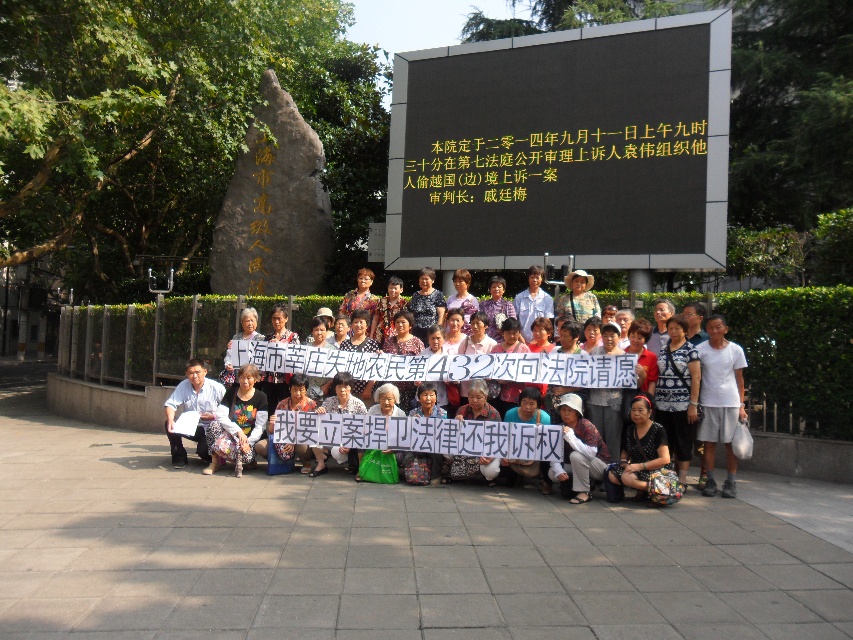
You are a photographer standing in front of the large stone monument. You notice the black matte sign at upper center and the white cotton shirt at center. Which object is taller?

The black matte sign at upper center is taller than the white cotton shirt at center.

You are a photographer standing in front of the monument and the digital display board. You want to take a photo that clearly shows both the black matte sign at upper center and the yellow text at upper center. However, you notice that one of them is blocking the other. Which object is blocking the other?

The black matte sign at upper center is blocking the yellow text at upper center because it is positioned in front of it.